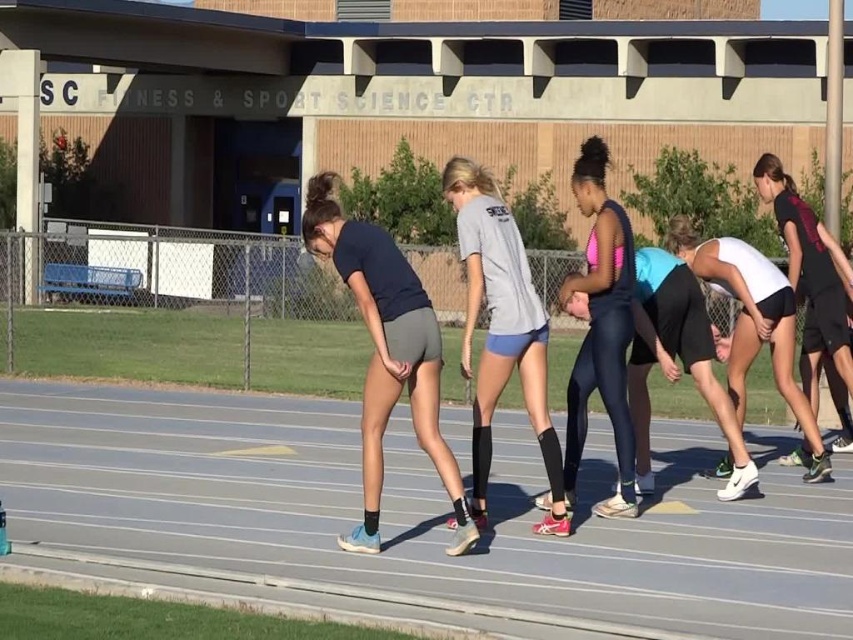
Question: Can you confirm if matte pink tank top at center is positioned below black athletic shorts at right?

Choices:
 (A) no
 (B) yes

Answer: (B)

Question: Which point is farther to the camera?

Choices:
 (A) (595, 262)
 (B) (462, 234)
 (C) (740, 385)

Answer: (C)

Question: Considering the real-world distances, which object is farthest from the black athletic shorts at right?

Choices:
 (A) matte pink tank top at center
 (B) white matte tank top at center

Answer: (A)

Question: Which point is closer to the camera?

Choices:
 (A) pos(459,241)
 (B) pos(618,296)
 (C) pos(375,360)

Answer: (C)

Question: Does gray rubber race track at center appear on the right side of black athletic shorts at right?

Choices:
 (A) yes
 (B) no

Answer: (B)

Question: Observing the image, what is the correct spatial positioning of gray cotton t-shirt at center in reference to black athletic shorts at right?

Choices:
 (A) left
 (B) right

Answer: (A)